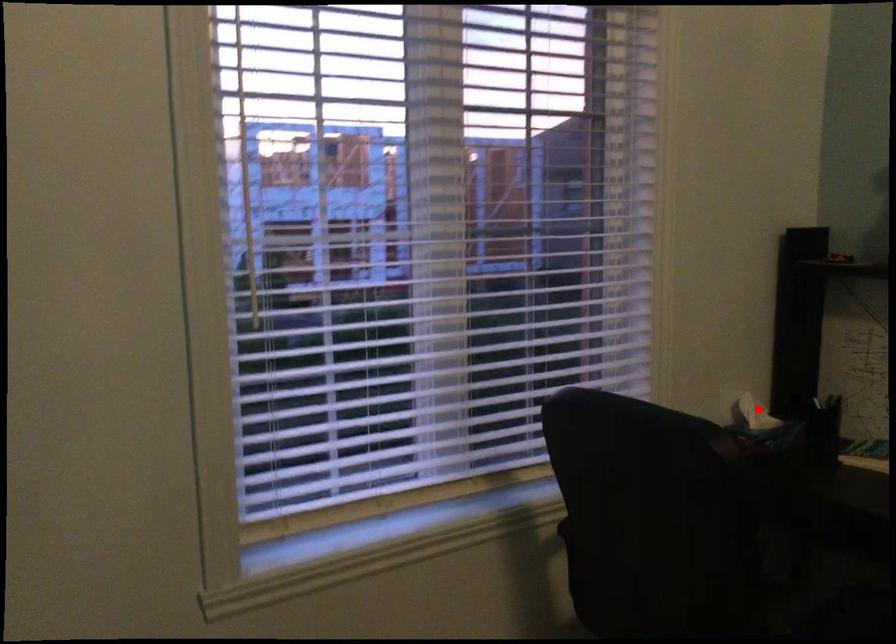
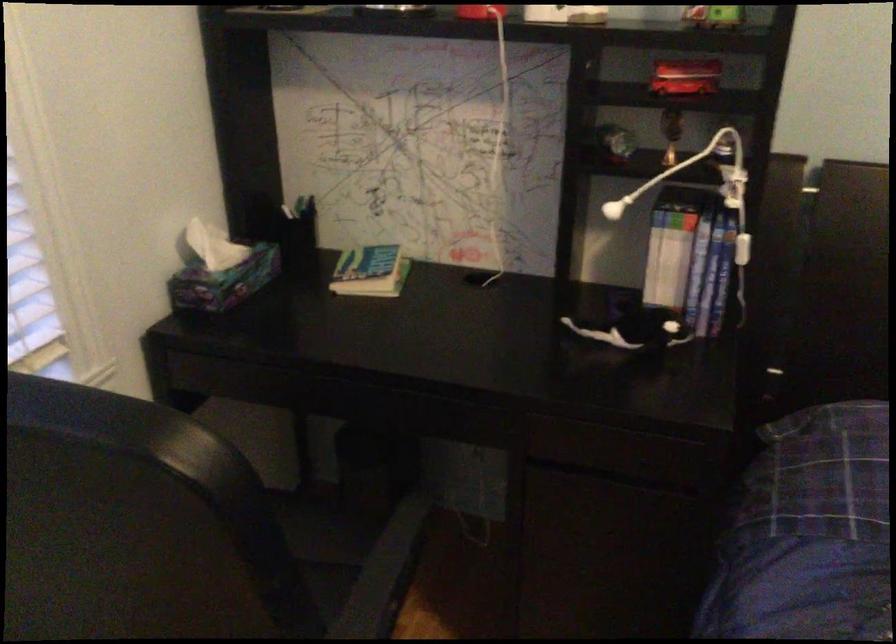
Find the pixel in the second image that matches the highlighted location in the first image.

(213, 245)